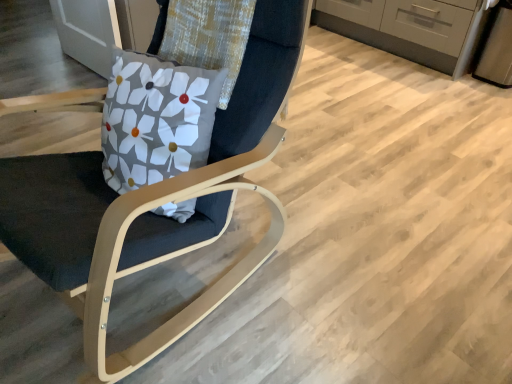
Question: In the image, is matte gray cabinetry at upper right on the left side or the right side of matte wood chair at center?

Choices:
 (A) left
 (B) right

Answer: (B)

Question: From their relative heights in the image, would you say matte gray cabinetry at upper right is taller or shorter than matte wood chair at center?

Choices:
 (A) short
 (B) tall

Answer: (A)

Question: Is matte gray cabinetry at upper right wider or thinner than matte wood chair at center?

Choices:
 (A) thin
 (B) wide

Answer: (A)

Question: Considering the positions of matte wood chair at center and matte gray cabinetry at upper right in the image, is matte wood chair at center wider or thinner than matte gray cabinetry at upper right?

Choices:
 (A) wide
 (B) thin

Answer: (A)

Question: From a real-world perspective, is matte wood chair at center physically located above or below matte gray cabinetry at upper right?

Choices:
 (A) above
 (B) below

Answer: (A)

Question: From the image's perspective, is matte wood chair at center positioned above or below matte gray cabinetry at upper right?

Choices:
 (A) above
 (B) below

Answer: (B)

Question: In the image, is matte wood chair at center positioned in front of or behind matte gray cabinetry at upper right?

Choices:
 (A) front
 (B) behind

Answer: (A)